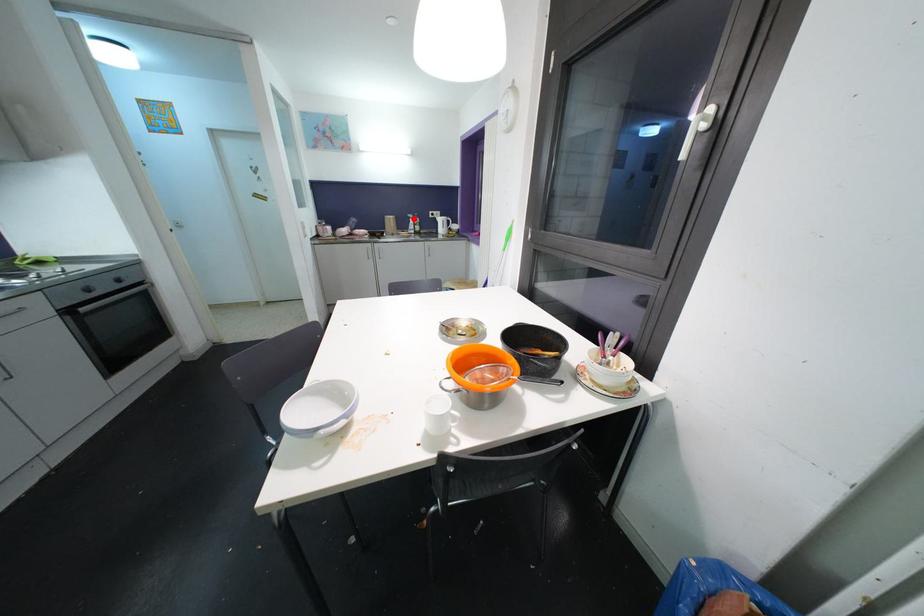
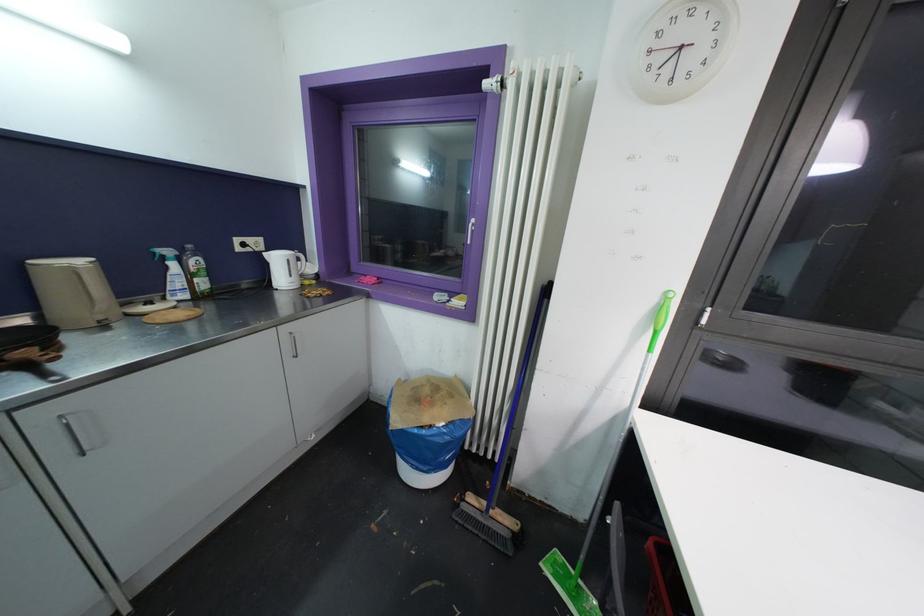
Where in the second image is the point corresponding to the highlighted location from the first image?

(171, 254)